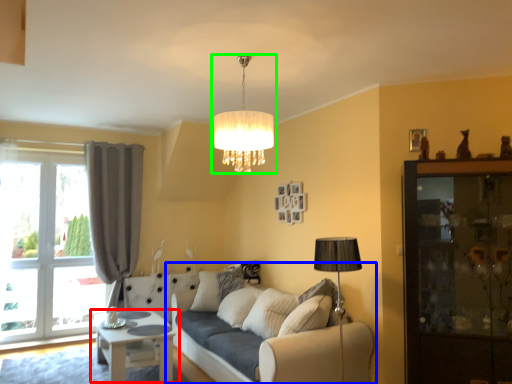
Question: Based on their relative distances, which object is nearer to table (highlighted by a red box)? Choose from studio couch (highlighted by a blue box) and lamp (highlighted by a green box).

Choices:
 (A) studio couch
 (B) lamp

Answer: (A)